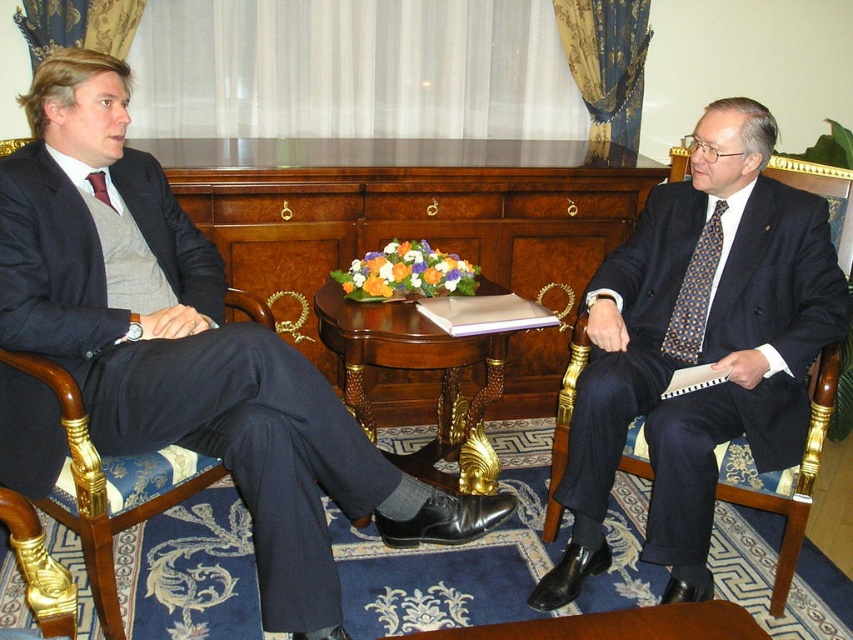
You are a photographer positioned behind the two men in the meeting scene. You want to capture a clear shot of the matte black suit at left without the matte red tie at left blocking it. Is this possible based on their positions?

Yes, since the matte black suit at left is in front of the matte red tie at left, the photographer can capture a clear shot of the matte black suit at left without obstruction from the matte red tie at left.

You are standing in the meeting room and want to know which of the two points, point (x=606, y=566) or point (x=670, y=339), is closer to you. Can you determine this based on the scene?

Point (x=606, y=566) is closer to the viewer than point (x=670, y=339).